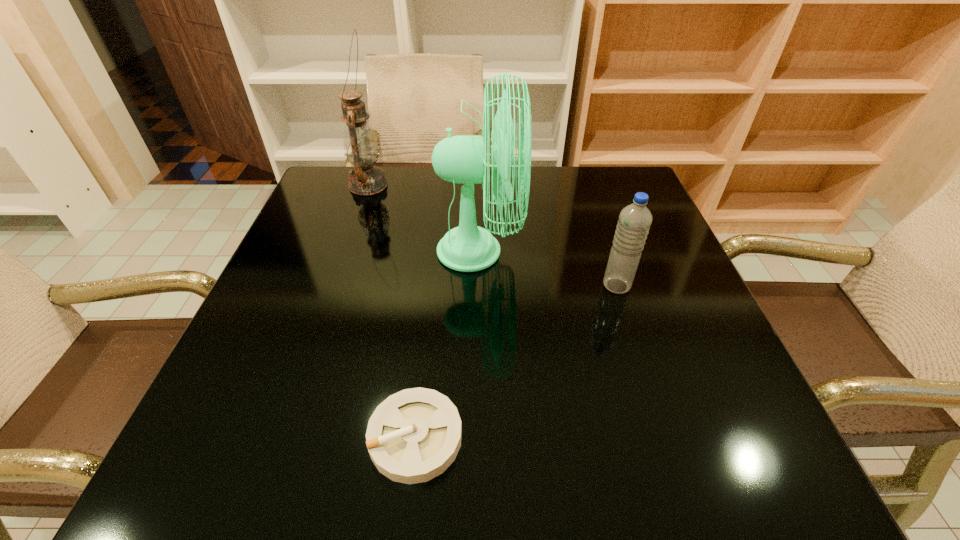
At what (x,y) coordinates should I click in order to perform the action: click on the leftmost object. Please return your answer as a coordinate pair (x, y). The image size is (960, 540). Looking at the image, I should click on (360, 145).

Locate an element on the screen. The width and height of the screenshot is (960, 540). the farthest object is located at coordinates (360, 145).

Identify the location of fan. (461, 159).

Locate an element on the screen. The height and width of the screenshot is (540, 960). the rightmost object is located at coordinates (634, 222).

Where is `the third tallest object`? The height and width of the screenshot is (540, 960). the third tallest object is located at coordinates (634, 222).

Find the location of a particular element. The width and height of the screenshot is (960, 540). the nearest object is located at coordinates (413, 436).

Find the location of a particular element. the shortest object is located at coordinates (413, 436).

The height and width of the screenshot is (540, 960). I want to click on free space located on the front of the leftmost object, so click(x=357, y=218).

Find the location of a particular element. Image resolution: width=960 pixels, height=540 pixels. free location located 0.100m in front of the fan to blow air is located at coordinates (564, 251).

The width and height of the screenshot is (960, 540). What are the coordinates of `free location located on the front of the second shortest object` in the screenshot? It's located at (636, 347).